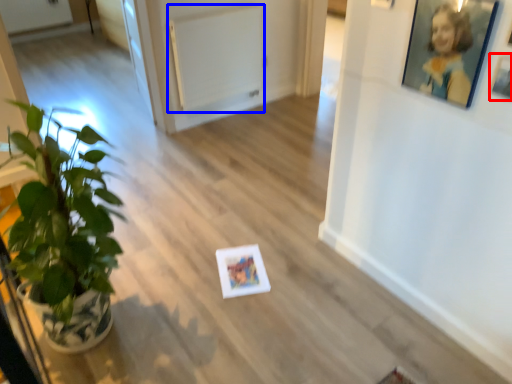
Question: Which object is closer to the camera taking this photo, picture frame (highlighted by a red box) or radiator (highlighted by a blue box)?

Choices:
 (A) picture frame
 (B) radiator

Answer: (A)